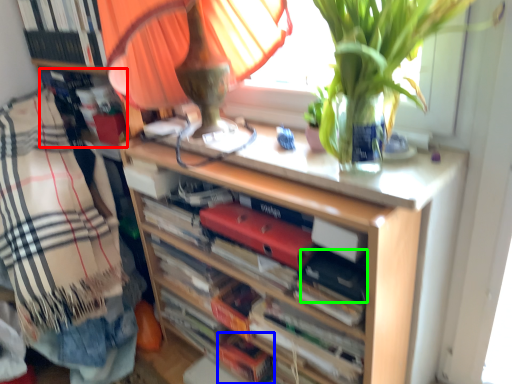
Question: Based on their relative distances, which object is farther from book (highlighted by a red box)? Choose from book (highlighted by a blue box) and paperback book (highlighted by a green box).

Choices:
 (A) book
 (B) paperback book

Answer: (B)